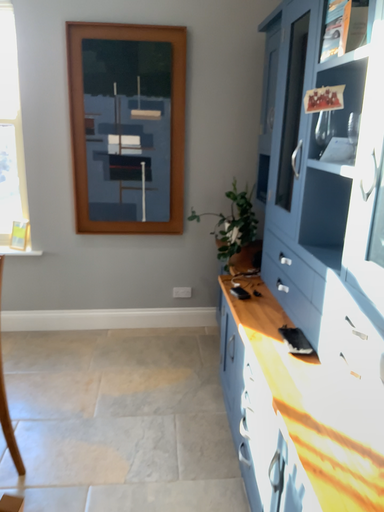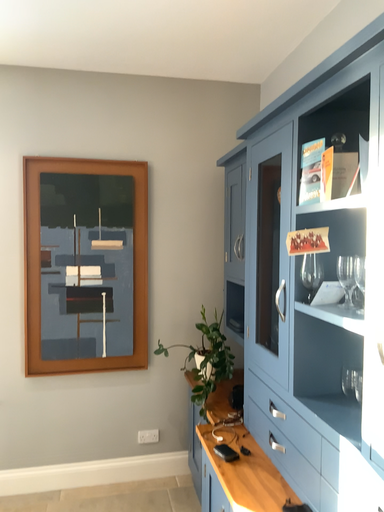
Question: Which way did the camera rotate in the video?

Choices:
 (A) rotated left
 (B) rotated right

Answer: (B)